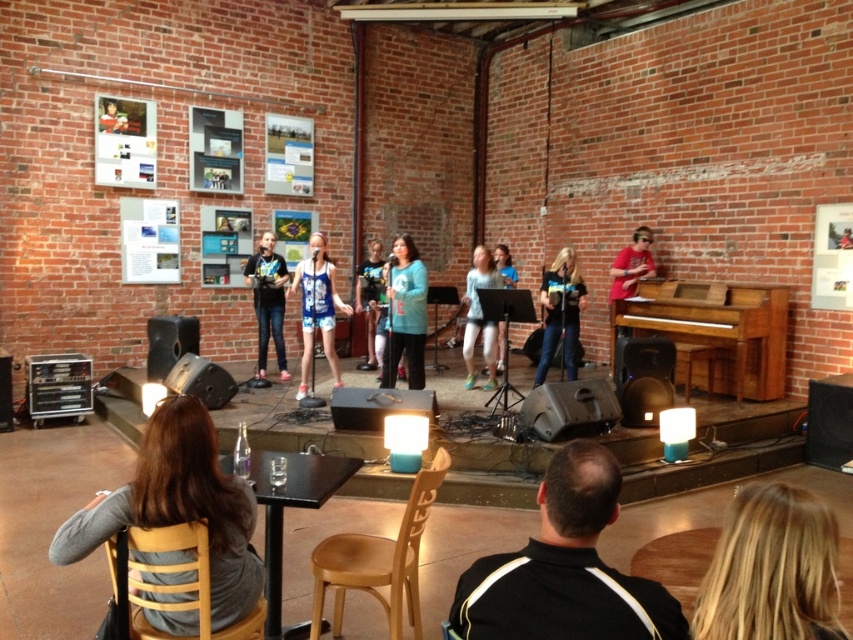
You are an event organizer setting up chairs for an audience. You need to place chairs in a way that they face both the gray fabric shirt at lower left and the black matte speaker at lower right. Which side of the stage should you position the chairs to ensure they can see both objects?

The gray fabric shirt at lower left is to the left of the black matte speaker at lower right, so positioning the chairs in front of the stage between them would allow the audience to see both objects.

You are a photographer standing behind the stage. You need to capture a photo that includes both the black leather jacket at lower right and the teal sweater at center. Given that your camera has a maximum focal length that allows capturing objects up to 15 feet apart in the same frame, will you be able to include both subjects in one shot?

The black leather jacket at lower right and teal sweater at center are 14.96 feet apart from each other, so yes, the photographer can include both subjects in one shot since the distance is within the camera maximum focal length of 15 feet.